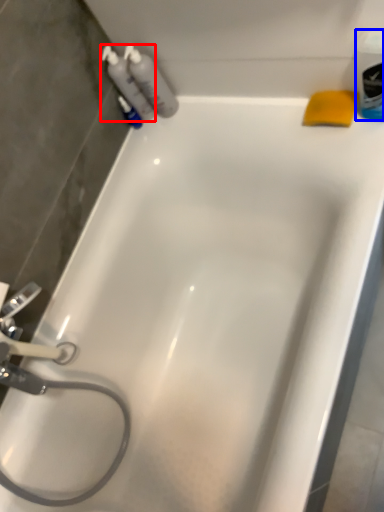
Question: Among these objects, which one is nearest to the camera, cleaning product (highlighted by a red box) or mouthwash (highlighted by a blue box)?

Choices:
 (A) cleaning product
 (B) mouthwash

Answer: (B)